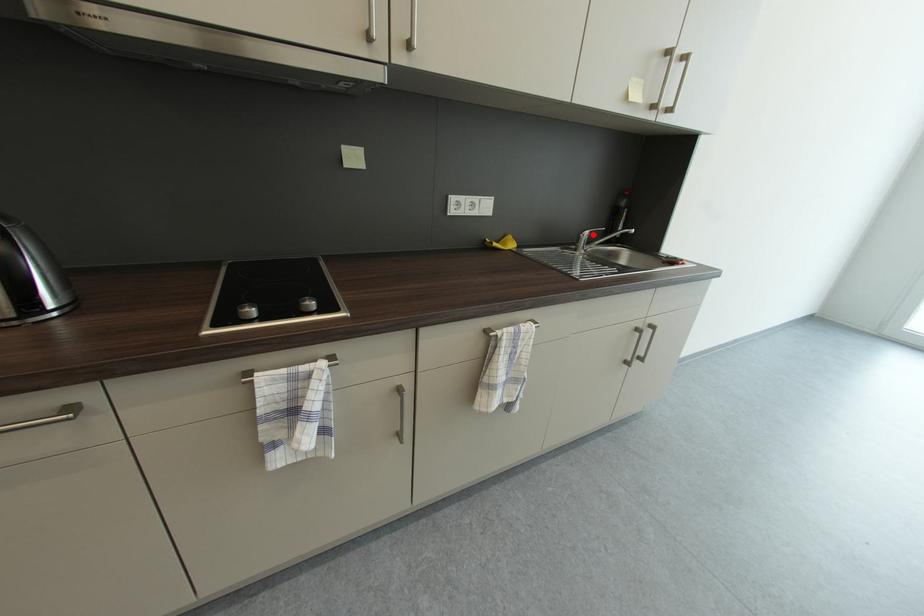
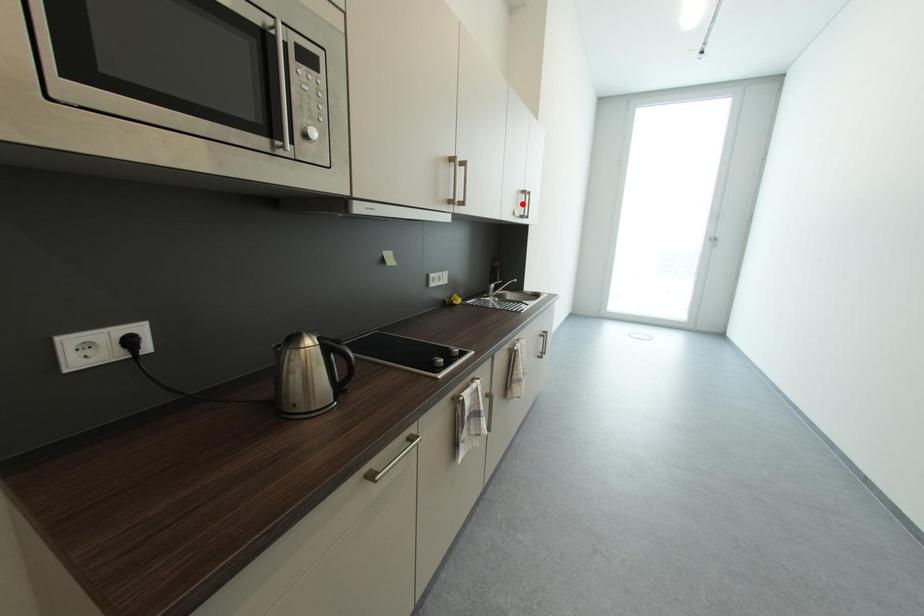
I am providing you with two images of the same scene from different viewpoints. A red point is marked on the first image and another point is marked on the second image. Is the marked point in image1 the same physical position as the marked point in image2?

No